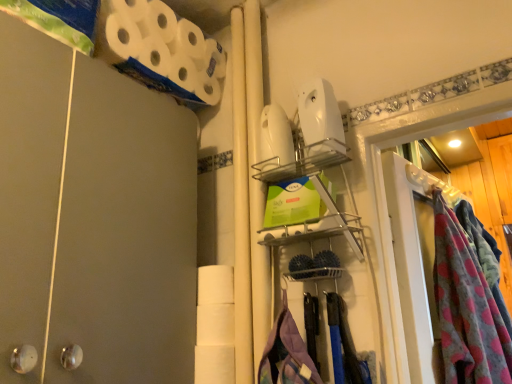
Question: Is white matte toilet paper at center, marked as the 1th toilet paper in a bottom-to-top arrangement, positioned before fluffy pink blanket at right?

Choices:
 (A) yes
 (B) no

Answer: (B)

Question: Is white matte toilet paper at center, marked as the 1th toilet paper in a bottom-to-top arrangement, bigger than fluffy pink blanket at right?

Choices:
 (A) no
 (B) yes

Answer: (A)

Question: Is white matte toilet paper at center, the second toilet paper when ordered from top to bottom, aimed at fluffy pink blanket at right?

Choices:
 (A) no
 (B) yes

Answer: (A)

Question: Is white matte toilet paper at center, the second toilet paper when ordered from top to bottom, positioned behind fluffy pink blanket at right?

Choices:
 (A) no
 (B) yes

Answer: (B)

Question: From the image's perspective, is white matte toilet paper at center, marked as the 1th toilet paper in a bottom-to-top arrangement, under fluffy pink blanket at right?

Choices:
 (A) no
 (B) yes

Answer: (B)

Question: In terms of width, does fluffy pink blanket at right look wider or thinner when compared to matte gray barn door at left?

Choices:
 (A) thin
 (B) wide

Answer: (A)

Question: Based on their positions, is fluffy pink blanket at right located to the left or right of matte gray barn door at left?

Choices:
 (A) left
 (B) right

Answer: (B)

Question: From a real-world perspective, relative to matte gray barn door at left, is fluffy pink blanket at right vertically above or below?

Choices:
 (A) above
 (B) below

Answer: (B)

Question: Is fluffy pink blanket at right taller or shorter than matte gray barn door at left?

Choices:
 (A) tall
 (B) short

Answer: (B)

Question: Is white matte toilet paper at center, the second toilet paper when ordered from top to bottom, inside or outside of matte gray barn door at left?

Choices:
 (A) inside
 (B) outside

Answer: (B)

Question: Considering the positions of white matte toilet paper at center, the second toilet paper when ordered from top to bottom, and matte gray barn door at left in the image, is white matte toilet paper at center, the second toilet paper when ordered from top to bottom, bigger or smaller than matte gray barn door at left?

Choices:
 (A) small
 (B) big

Answer: (A)

Question: From the image's perspective, is white matte toilet paper at center, the second toilet paper when ordered from top to bottom, above or below matte gray barn door at left?

Choices:
 (A) above
 (B) below

Answer: (B)

Question: Relative to matte gray barn door at left, is white matte toilet paper at center, the second toilet paper when ordered from top to bottom, in front or behind?

Choices:
 (A) front
 (B) behind

Answer: (B)

Question: From the image's perspective, is white matte toilet paper at center, the second toilet paper when ordered from top to bottom, positioned above or below white matte toilet paper at upper left, placed as the 2th toilet paper when sorted from bottom to top?

Choices:
 (A) above
 (B) below

Answer: (B)

Question: From a real-world perspective, is white matte toilet paper at center, marked as the 1th toilet paper in a bottom-to-top arrangement, above or below white matte toilet paper at upper left, marked as the 1th toilet paper in a top-to-bottom arrangement?

Choices:
 (A) below
 (B) above

Answer: (A)